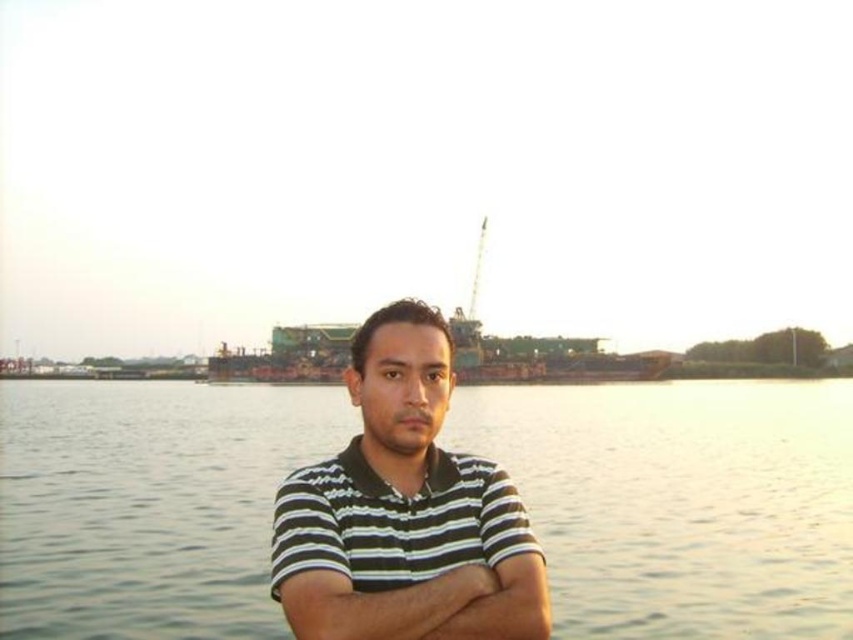
You are a photographer positioned at the camera. You want to capture a closeup shot of the striped cotton shirt at center. Given that your camera has a maximum zoom range of 25 meters, can you achieve this without moving closer?

The striped cotton shirt at center and camera are 27.64 meters apart from each other. Since the maximum zoom range is 25 meters, the camera cannot capture a closeup shot of the striped cotton shirt at center without moving closer.

You are an observer looking at the scene. You notice two objects labeled as striped cotton shirt at center and striped fabric arm at center. Which object is positioned to the left?

The striped cotton shirt at center is to the left of the striped fabric arm at center.